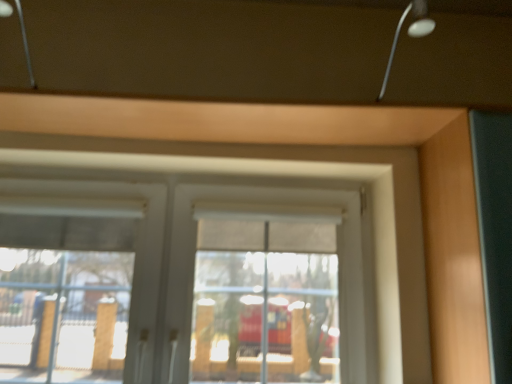
This screenshot has height=384, width=512. I want to click on metallic silver lamp at upper right, the 1th lamp in the right-to-left sequence, so click(x=409, y=32).

Image resolution: width=512 pixels, height=384 pixels. What do you see at coordinates (453, 256) in the screenshot?
I see `matte wood garage door at right` at bounding box center [453, 256].

Find the location of a particular element. Image resolution: width=512 pixels, height=384 pixels. metallic silver lamp at upper left, which appears as the 1th lamp when viewed from the left is located at coordinates (25, 43).

Between white matte window at center and metallic silver lamp at upper right, the 1th lamp in the right-to-left sequence, which one has less height?

metallic silver lamp at upper right, the 1th lamp in the right-to-left sequence.

Is white matte window at center not near metallic silver lamp at upper right, the 1th lamp in the right-to-left sequence?

No.

Based on the photo, is metallic silver lamp at upper right, the 1th lamp in the right-to-left sequence, a part of white matte window at center?

No, metallic silver lamp at upper right, the 1th lamp in the right-to-left sequence, is located outside of white matte window at center.

Find the location of a particular element. the 2nd lamp directly above the matte wood garage door at right (from a real-world perspective) is located at coordinates (409, 32).

Does metallic silver lamp at upper right, the 1th lamp in the right-to-left sequence, have a greater height compared to matte wood garage door at right?

No.

Consider the image. Considering the positions of objects metallic silver lamp at upper right, the 1th lamp in the right-to-left sequence, and matte wood garage door at right in the image provided, who is in front, metallic silver lamp at upper right, the 1th lamp in the right-to-left sequence, or matte wood garage door at right?

metallic silver lamp at upper right, the 1th lamp in the right-to-left sequence, is closer to the camera.

From the image's perspective, is metallic silver lamp at upper right, the 1th lamp in the right-to-left sequence, above or below matte wood garage door at right?

From the image's perspective, metallic silver lamp at upper right, the 1th lamp in the right-to-left sequence, appears above matte wood garage door at right.

Is point (407, 9) closer or farther from the camera than point (23, 42)?

Point (407, 9) appears to be farther away from the viewer than point (23, 42).

Is metallic silver lamp at upper right, which is the 2th lamp from left to right, next to metallic silver lamp at upper left, the 2th lamp positioned from the right?

No, metallic silver lamp at upper right, which is the 2th lamp from left to right, is not with metallic silver lamp at upper left, the 2th lamp positioned from the right.

Which object is closer to the camera taking this photo, metallic silver lamp at upper right, the 1th lamp in the right-to-left sequence, or metallic silver lamp at upper left, which appears as the 1th lamp when viewed from the left?

metallic silver lamp at upper left, which appears as the 1th lamp when viewed from the left.

From the image's perspective, is metallic silver lamp at upper right, which is the 2th lamp from left to right, on white matte window at center?

Indeed, from the image's perspective, metallic silver lamp at upper right, which is the 2th lamp from left to right, is shown above white matte window at center.

Can you confirm if metallic silver lamp at upper right, the 1th lamp in the right-to-left sequence, is positioned to the right of white matte window at center?

Yes.

Is metallic silver lamp at upper right, the 1th lamp in the right-to-left sequence, located outside white matte window at center?

Absolutely, metallic silver lamp at upper right, the 1th lamp in the right-to-left sequence, is external to white matte window at center.

Does metallic silver lamp at upper left, the 2th lamp positioned from the right, lie in front of metallic silver lamp at upper right, which is the 2th lamp from left to right?

Yes, it is.

In the scene shown: Is metallic silver lamp at upper left, which appears as the 1th lamp when viewed from the left, thinner than metallic silver lamp at upper right, which is the 2th lamp from left to right?

No.

Is metallic silver lamp at upper left, the 2th lamp positioned from the right, not inside metallic silver lamp at upper right, which is the 2th lamp from left to right?

Yes.

Does metallic silver lamp at upper left, the 2th lamp positioned from the right, have a larger size compared to white matte window at center?

No, metallic silver lamp at upper left, the 2th lamp positioned from the right, is not bigger than white matte window at center.

In the scene shown: Considering the sizes of objects metallic silver lamp at upper left, the 2th lamp positioned from the right, and white matte window at center in the image provided, who is shorter, metallic silver lamp at upper left, the 2th lamp positioned from the right, or white matte window at center?

metallic silver lamp at upper left, the 2th lamp positioned from the right, is shorter.

Which object is thinner, metallic silver lamp at upper left, the 2th lamp positioned from the right, or white matte window at center?

white matte window at center is thinner.

From the image's perspective, which one is positioned lower, metallic silver lamp at upper left, which appears as the 1th lamp when viewed from the left, or white matte window at center?

From the image's view, white matte window at center is below.

Find the location of a particular element. This screenshot has height=384, width=512. window on the right of metallic silver lamp at upper left, which appears as the 1th lamp when viewed from the left is located at coordinates (372, 221).

Is white matte window at center completely or partially outside of metallic silver lamp at upper left, which appears as the 1th lamp when viewed from the left?

white matte window at center lies outside metallic silver lamp at upper left, which appears as the 1th lamp when viewed from the left,'s area.

Considering the positions of objects white matte window at center and metallic silver lamp at upper left, which appears as the 1th lamp when viewed from the left, in the image provided, who is more to the left, white matte window at center or metallic silver lamp at upper left, which appears as the 1th lamp when viewed from the left,?

metallic silver lamp at upper left, which appears as the 1th lamp when viewed from the left, is more to the left.

Is white matte window at center far from metallic silver lamp at upper left, which appears as the 1th lamp when viewed from the left?

No, white matte window at center is not far from metallic silver lamp at upper left, which appears as the 1th lamp when viewed from the left.

The image size is (512, 384). I want to click on window on the left of metallic silver lamp at upper right, which is the 2th lamp from left to right, so click(x=372, y=221).

Where is `garage door below the metallic silver lamp at upper right, which is the 2th lamp from left to right (from a real-world perspective)`? garage door below the metallic silver lamp at upper right, which is the 2th lamp from left to right (from a real-world perspective) is located at coordinates coord(453,256).

Considering their positions, is metallic silver lamp at upper right, the 1th lamp in the right-to-left sequence, positioned further to metallic silver lamp at upper left, which appears as the 1th lamp when viewed from the left, than white matte window at center?

Among the two, metallic silver lamp at upper right, the 1th lamp in the right-to-left sequence, is located further to metallic silver lamp at upper left, which appears as the 1th lamp when viewed from the left.

Estimate the real-world distances between objects in this image. Which object is closer to matte wood garage door at right, white matte window at center or metallic silver lamp at upper right, which is the 2th lamp from left to right?

white matte window at center is positioned closer to the anchor matte wood garage door at right.

When comparing their distances from matte wood garage door at right, does white matte window at center or metallic silver lamp at upper left, the 2th lamp positioned from the right, seem closer?

white matte window at center.

Based on their spatial positions, is metallic silver lamp at upper right, which is the 2th lamp from left to right, or matte wood garage door at right further from white matte window at center?

Among the two, metallic silver lamp at upper right, which is the 2th lamp from left to right, is located further to white matte window at center.

Considering their positions, is metallic silver lamp at upper left, which appears as the 1th lamp when viewed from the left, positioned further to white matte window at center than matte wood garage door at right?

Based on the image, metallic silver lamp at upper left, which appears as the 1th lamp when viewed from the left, appears to be further to white matte window at center.

Which object lies nearer to the anchor point matte wood garage door at right, metallic silver lamp at upper right, which is the 2th lamp from left to right, or white matte window at center?

Among the two, white matte window at center is located nearer to matte wood garage door at right.

Based on their spatial positions, is metallic silver lamp at upper left, the 2th lamp positioned from the right, or metallic silver lamp at upper right, which is the 2th lamp from left to right, closer to matte wood garage door at right?

Among the two, metallic silver lamp at upper right, which is the 2th lamp from left to right, is located nearer to matte wood garage door at right.

Estimate the real-world distances between objects in this image. Which object is further from metallic silver lamp at upper left, which appears as the 1th lamp when viewed from the left, white matte window at center or matte wood garage door at right?

matte wood garage door at right is further to metallic silver lamp at upper left, which appears as the 1th lamp when viewed from the left.

Identify the location of window between metallic silver lamp at upper left, the 2th lamp positioned from the right, and metallic silver lamp at upper right, the 1th lamp in the right-to-left sequence. Image resolution: width=512 pixels, height=384 pixels. (372, 221).

At what (x,y) coordinates should I click in order to perform the action: click on window between metallic silver lamp at upper left, the 2th lamp positioned from the right, and matte wood garage door at right from left to right. Please return your answer as a coordinate pair (x, y). Looking at the image, I should click on (372, 221).

Find the location of a particular element. The height and width of the screenshot is (384, 512). lamp between white matte window at center and matte wood garage door at right is located at coordinates (409, 32).

Find the location of a particular element. lamp between metallic silver lamp at upper left, the 2th lamp positioned from the right, and matte wood garage door at right, in the horizontal direction is located at coordinates (409, 32).